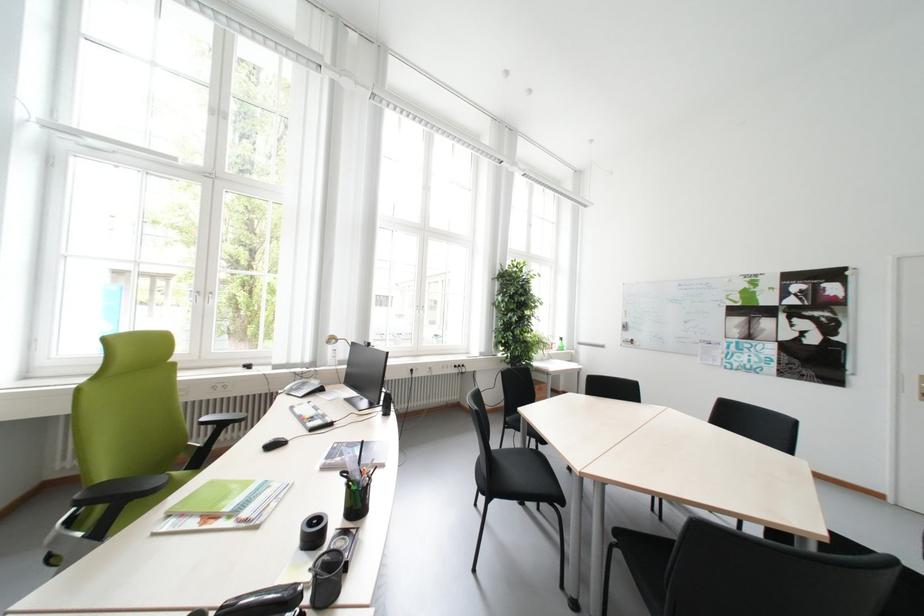
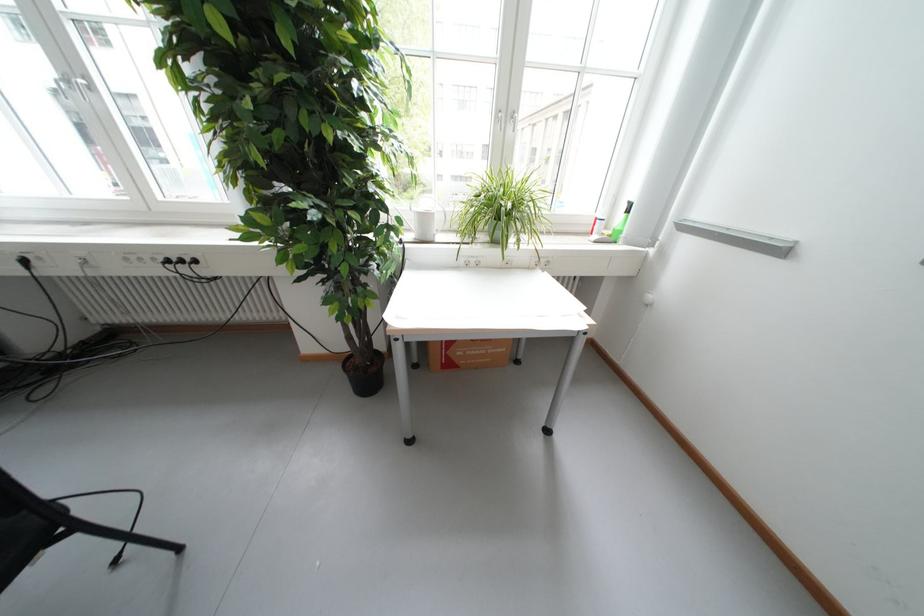
Find the pixel in the second image that matches [466,368] in the first image.

(177, 262)